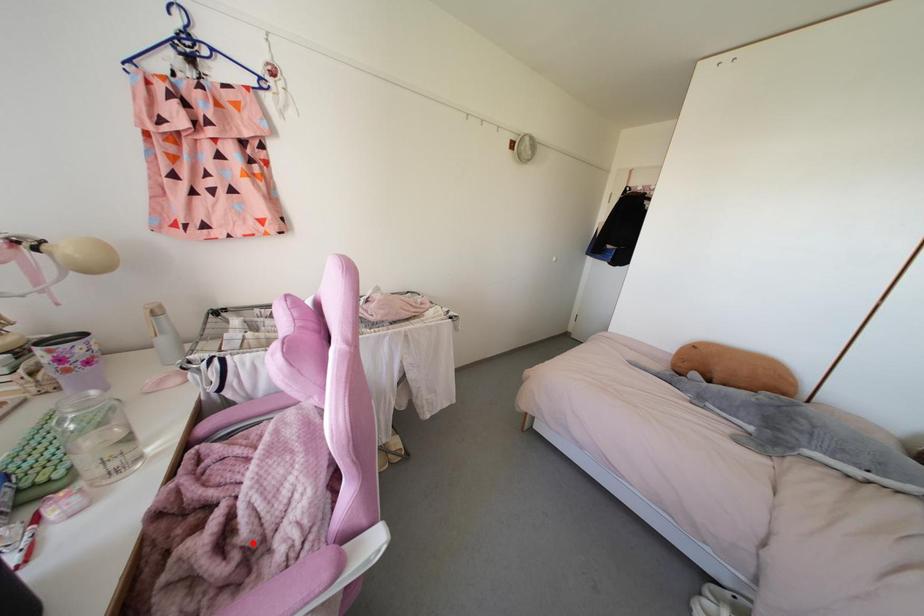
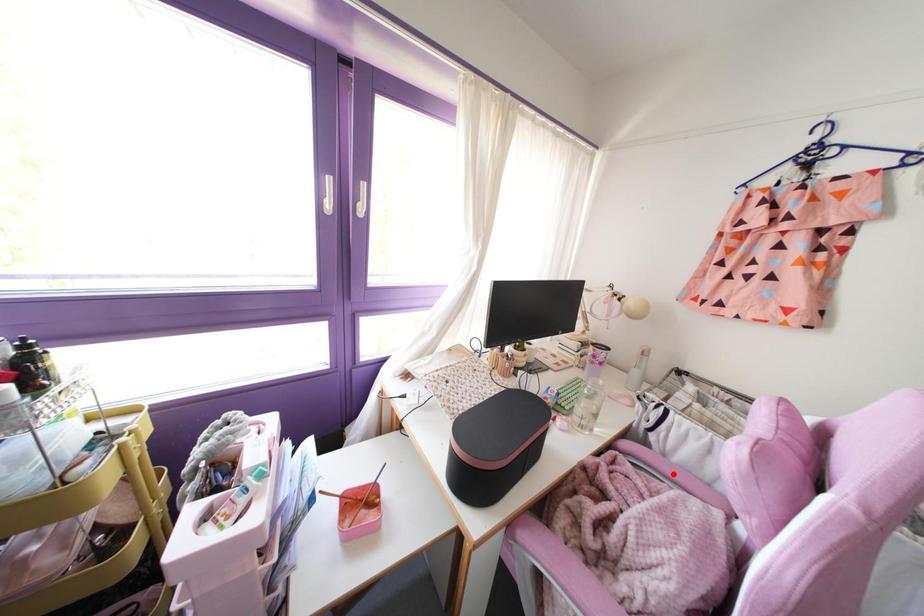
I am providing you with two images of the same scene from different viewpoints. A red point is marked on the first image and another point is marked on the second image. Is the red point in image1 aligned with the point shown in image2?

No